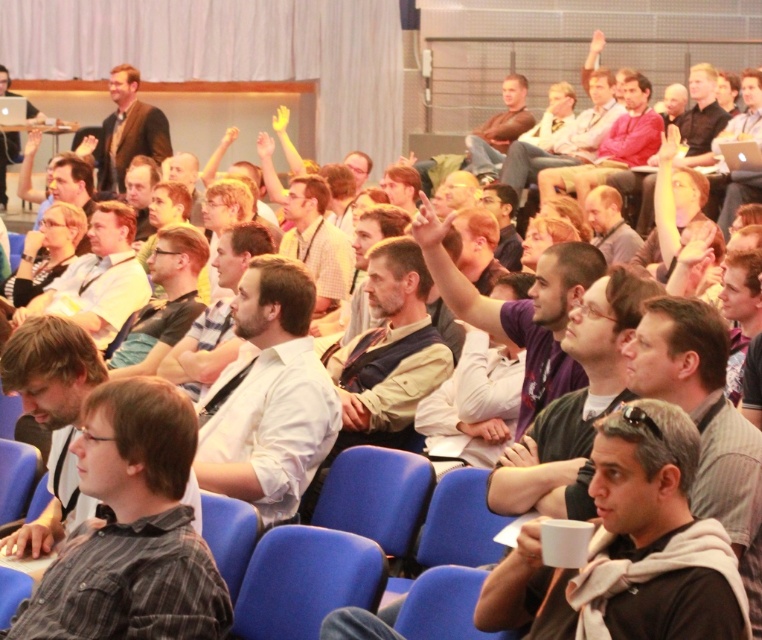
Question: Does gray striped shirt at center come behind matte black glasses at center?

Choices:
 (A) yes
 (B) no

Answer: (B)

Question: Considering the real-world distances, which object is farthest from the white shirt at center?

Choices:
 (A) matte black glasses at center
 (B) gray striped shirt at center

Answer: (A)

Question: Does white shirt at center appear on the left side of matte black glasses at center?

Choices:
 (A) no
 (B) yes

Answer: (A)

Question: From the image, what is the correct spatial relationship of gray striped shirt at center in relation to matte black glasses at center?

Choices:
 (A) below
 (B) above

Answer: (A)

Question: Based on their relative distances, which object is farther from the white shirt at center?

Choices:
 (A) matte black glasses at center
 (B) gray striped shirt at center

Answer: (A)

Question: Considering the real-world distances, which object is farthest from the gray striped shirt at center?

Choices:
 (A) matte black glasses at center
 (B) white shirt at center

Answer: (A)